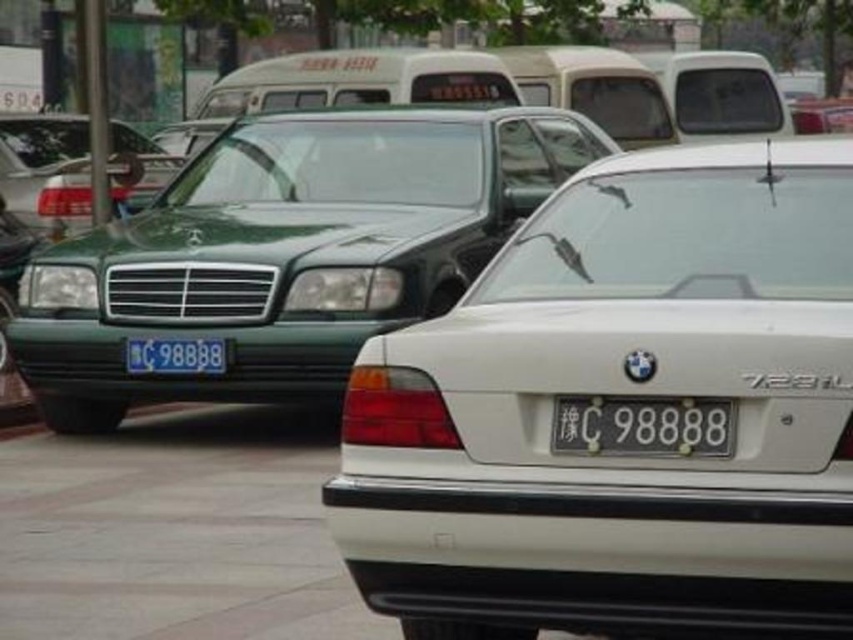
Does green matte sedan at left appear over white plastic license plate at center?

Indeed, green matte sedan at left is positioned over white plastic license plate at center.

Between green matte sedan at left and white plastic license plate at center, which one is positioned lower?

white plastic license plate at center

What do you see at coordinates (45, 168) in the screenshot? I see `green matte sedan at left` at bounding box center [45, 168].

The height and width of the screenshot is (640, 853). What are the coordinates of `green matte sedan at left` in the screenshot? It's located at (45, 168).

From the picture: Does green matte sedan at upper left have a lesser width compared to green matte sedan at left?

In fact, green matte sedan at upper left might be wider than green matte sedan at left.

Which of these two, green matte sedan at upper left or green matte sedan at left, stands taller?

With more height is green matte sedan at upper left.

Describe the element at coordinates (287, 252) in the screenshot. Image resolution: width=853 pixels, height=640 pixels. I see `green matte sedan at upper left` at that location.

Locate an element on the screen. green matte sedan at upper left is located at coordinates (287, 252).

Which is below, white glossy sedan at center or gray concrete pavement at lower center?

gray concrete pavement at lower center is below.

Which is behind, point (671, 243) or point (114, 470)?

The point (114, 470) is more distant.

What are the coordinates of `white glossy sedan at center` in the screenshot? It's located at (622, 396).